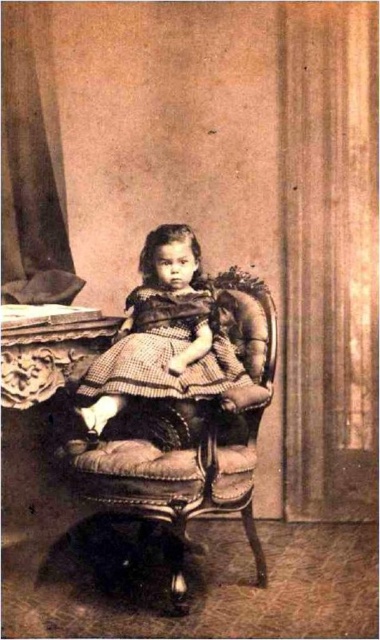
Based on the scene description, where is the velvet upholstered armchair at center located in terms of its 2D coordinates?

The velvet upholstered armchair at center is located at the 2D coordinates of point (191, 435).

Based on the scene described, if you were to place a small decorative pillow on the velvet upholstered armchair at center, would it still be larger than the checkered fabric dress at center?

The velvet upholstered armchair at center is bigger than the checkered fabric dress at center, so even with a small decorative pillow added, the velvet upholstered armchair at center would still remain larger than the checkered fabric dress at center.